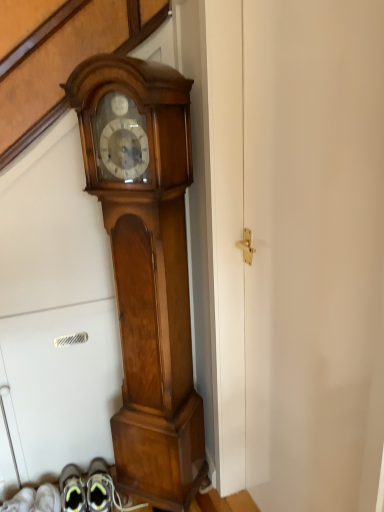
Image resolution: width=384 pixels, height=512 pixels. Describe the element at coordinates (146, 265) in the screenshot. I see `polished wood grandfather clock at center` at that location.

This screenshot has width=384, height=512. What are the coordinates of `polished wood grandfather clock at center` in the screenshot? It's located at (146, 265).

In order to face polished wood grandfather clock at center, should I rotate leftwards or rightwards?

Turn left approximately 5.994 degrees to face it.

What do you see at coordinates (308, 251) in the screenshot?
I see `white matte door at center` at bounding box center [308, 251].

Identify the location of white matte door at center. This screenshot has width=384, height=512. tap(308, 251).

The width and height of the screenshot is (384, 512). Identify the location of polished wood grandfather clock at center. (146, 265).

Does white matte door at center appear on the left side of polished wood grandfather clock at center?

No.

Does white matte door at center come in front of polished wood grandfather clock at center?

Yes, it is in front of polished wood grandfather clock at center.

Does point (361, 202) come in front of point (160, 395)?

Yes, it is in front of point (160, 395).

From the image's perspective, is white matte door at center above polished wood grandfather clock at center?

No, from the image's perspective, white matte door at center is not over polished wood grandfather clock at center.

From the picture: From a real-world perspective, is white matte door at center below polished wood grandfather clock at center?

No.

Looking at their sizes, would you say white matte door at center is wider or thinner than polished wood grandfather clock at center?

Clearly, white matte door at center has less width compared to polished wood grandfather clock at center.

Does white matte door at center have a greater height compared to polished wood grandfather clock at center?

Yes.

Considering the sizes of objects white matte door at center and polished wood grandfather clock at center in the image provided, who is smaller, white matte door at center or polished wood grandfather clock at center?

Smaller between the two is polished wood grandfather clock at center.

Looking at this image, is polished wood grandfather clock at center located within white matte door at center?

No, polished wood grandfather clock at center is not inside white matte door at center.

Would you say white matte door at center is a long distance from polished wood grandfather clock at center?

No, white matte door at center is not far from polished wood grandfather clock at center.

Is white matte door at center aimed at polished wood grandfather clock at center?

No, white matte door at center is not aimed at polished wood grandfather clock at center.

In order to click on door below the polished wood grandfather clock at center (from the image's perspective) in this screenshot , I will do `click(308, 251)`.

Considering the relative positions of polished wood grandfather clock at center and white matte door at center in the image provided, is polished wood grandfather clock at center to the left of white matte door at center from the viewer's perspective?

Yes, polished wood grandfather clock at center is to the left of white matte door at center.

In the image, is polished wood grandfather clock at center positioned in front of or behind white matte door at center?

Clearly, polished wood grandfather clock at center is behind white matte door at center.

Which is less distant, (155, 271) or (346, 380)?

The point (346, 380) is more forward.

From the image's perspective, which object appears higher, polished wood grandfather clock at center or white matte door at center?

polished wood grandfather clock at center is shown above in the image.

From a real-world perspective, between polished wood grandfather clock at center and white matte door at center, who is vertically higher?

white matte door at center, from a real-world perspective.

Which of these two, polished wood grandfather clock at center or white matte door at center, is wider?

polished wood grandfather clock at center is wider.

Between polished wood grandfather clock at center and white matte door at center, which one has more height?

white matte door at center.

Between polished wood grandfather clock at center and white matte door at center, which one has smaller size?

With smaller size is polished wood grandfather clock at center.

Is polished wood grandfather clock at center not within white matte door at center?

Yes, polished wood grandfather clock at center is outside of white matte door at center.

Are polished wood grandfather clock at center and white matte door at center located far from each other?

They are positioned close to each other.

Is polished wood grandfather clock at center facing away from white matte door at center?

No, white matte door at center is not at the back of polished wood grandfather clock at center.

How much distance is there between polished wood grandfather clock at center and white matte door at center?

polished wood grandfather clock at center and white matte door at center are 12.44 inches apart.

Identify the location of door below the polished wood grandfather clock at center (from the image's perspective). (308, 251).

Image resolution: width=384 pixels, height=512 pixels. In the image, there is a white matte door at center. Identify the location of wall clock below it (from a real-world perspective). (146, 265).

Locate an element on the screen. door in front of the polished wood grandfather clock at center is located at coordinates pyautogui.click(x=308, y=251).